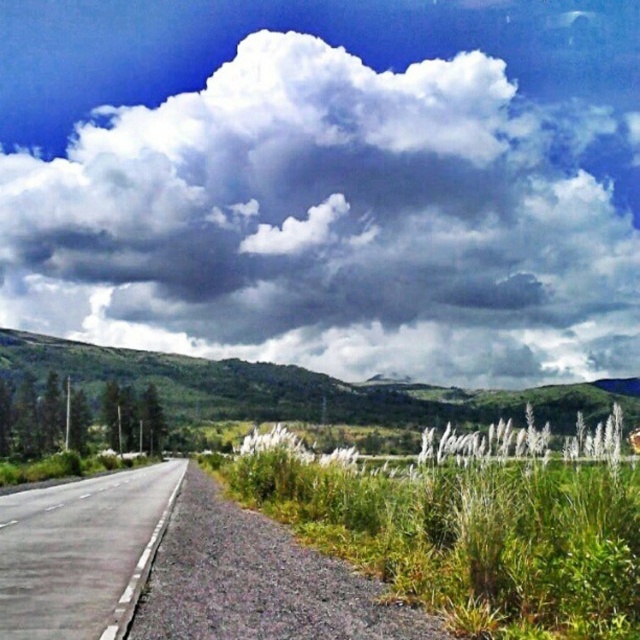
Question: Is white fluffy cloud at upper center below asphalt road at left?

Choices:
 (A) yes
 (B) no

Answer: (B)

Question: Is white fluffy cloud at upper center bigger than asphalt road at left?

Choices:
 (A) yes
 (B) no

Answer: (A)

Question: Is white fluffy cloud at upper center closer to the viewer compared to asphalt road at left?

Choices:
 (A) yes
 (B) no

Answer: (B)

Question: Which of the following is the closest to the observer?

Choices:
 (A) white fluffy cloud at upper center
 (B) asphalt road at left

Answer: (B)